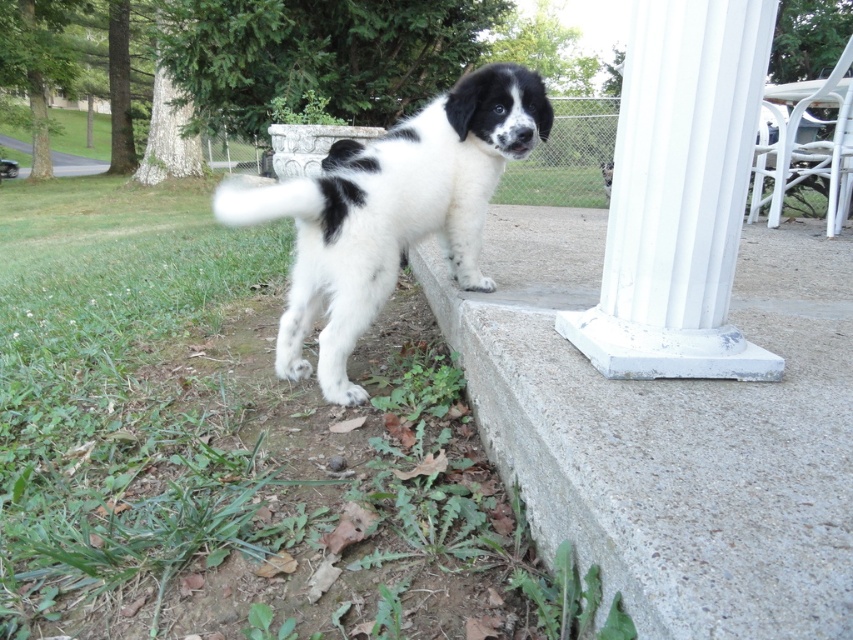
Question: Can you confirm if white painted concrete column at center right is wider than black and white fur at center?

Choices:
 (A) yes
 (B) no

Answer: (B)

Question: Which point appears closest to the camera in this image?

Choices:
 (A) (633, 396)
 (B) (332, 356)
 (C) (283, 209)
 (D) (730, 204)

Answer: (A)

Question: Which object appears closest to the camera in this image?

Choices:
 (A) white painted concrete column at center right
 (B) white fluffy tail at lower left
 (C) black and white fur at center

Answer: (A)

Question: Can you confirm if black and white fur at center is bigger than white fluffy tail at lower left?

Choices:
 (A) no
 (B) yes

Answer: (A)

Question: Is concrete at lower right smaller than black and white fur at center?

Choices:
 (A) no
 (B) yes

Answer: (A)

Question: Which object appears farthest from the camera in this image?

Choices:
 (A) black and white fur at center
 (B) white painted concrete column at center right
 (C) white fluffy tail at lower left
 (D) concrete at lower right

Answer: (C)